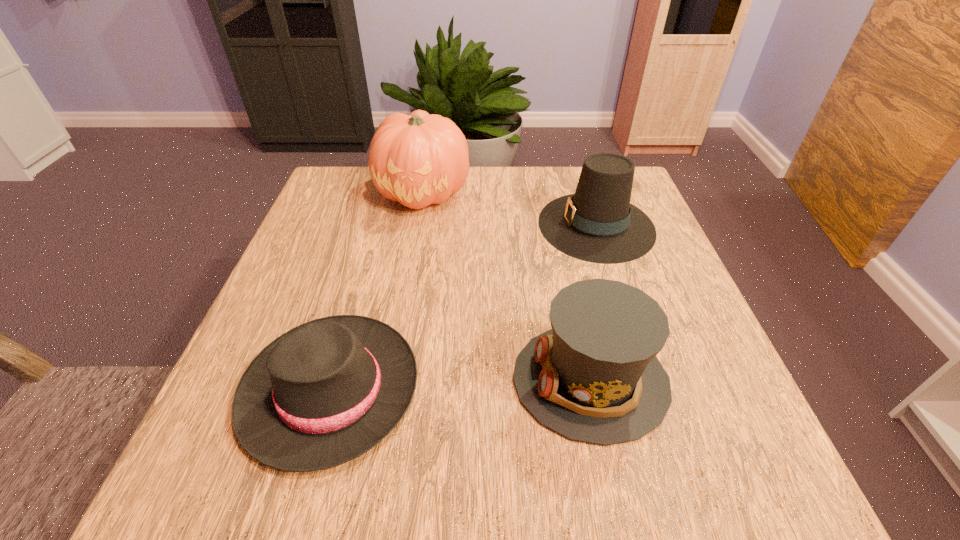
The height and width of the screenshot is (540, 960). Identify the location of hat located at the far edge. (598, 224).

This screenshot has width=960, height=540. Identify the location of pumpkin located in the left edge section of the desktop. (419, 159).

Find the location of a particular element. The width and height of the screenshot is (960, 540). dress hat that is positioned at the left edge is located at coordinates (325, 392).

This screenshot has height=540, width=960. What are the coordinates of `object that is at the far left corner` in the screenshot? It's located at (419, 159).

At what (x,y) coordinates should I click in order to perform the action: click on object present at the near left corner. Please return your answer as a coordinate pair (x, y). Looking at the image, I should click on (325, 392).

You are a GUI agent. You are given a task and a screenshot of the screen. Output one action in this format:
    pyautogui.click(x=<x>, y=<y>)
    Task: Click on the object positioned at the far right corner
    
    Given the screenshot: What is the action you would take?
    pyautogui.click(x=598, y=224)

Identify the location of object present at the near right corner. (594, 377).

Find the location of a particular element. Image resolution: width=960 pixels, height=540 pixels. free region at the far edge of the desktop is located at coordinates (389, 211).

The image size is (960, 540). In the image, there is a desktop. In order to click on vacant space at the left edge in this screenshot , I will do (x=343, y=246).

Where is `vacant space at the right edge of the desktop`? The image size is (960, 540). vacant space at the right edge of the desktop is located at coordinates (687, 296).